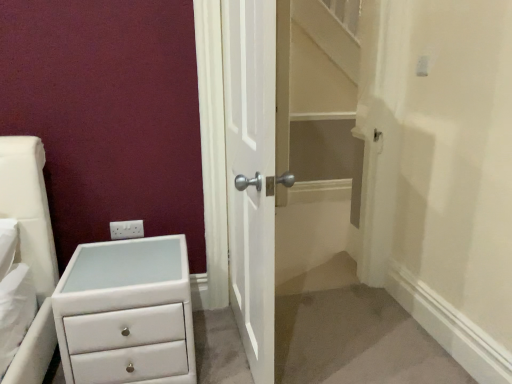
Question: Is white glossy chest of drawers at lower left positioned far away from white wooden door at center?

Choices:
 (A) no
 (B) yes

Answer: (A)

Question: Is white wooden door at center located within white glossy chest of drawers at lower left?

Choices:
 (A) no
 (B) yes

Answer: (A)

Question: Considering the relative sizes of white glossy chest of drawers at lower left and white wooden door at center in the image provided, is white glossy chest of drawers at lower left bigger than white wooden door at center?

Choices:
 (A) yes
 (B) no

Answer: (B)

Question: From a real-world perspective, is white glossy chest of drawers at lower left on top of white wooden door at center?

Choices:
 (A) no
 (B) yes

Answer: (A)

Question: Can you confirm if white glossy chest of drawers at lower left is thinner than white wooden door at center?

Choices:
 (A) yes
 (B) no

Answer: (B)

Question: In the image, is white plastic electric outlet at upper left positioned in front of or behind white glossy chest of drawers at lower left?

Choices:
 (A) behind
 (B) front

Answer: (A)

Question: Is white plastic electric outlet at upper left situated inside white glossy chest of drawers at lower left or outside?

Choices:
 (A) inside
 (B) outside

Answer: (B)

Question: From the image's perspective, is white plastic electric outlet at upper left positioned above or below white glossy chest of drawers at lower left?

Choices:
 (A) above
 (B) below

Answer: (A)

Question: Is point (129, 236) closer or farther from the camera than point (88, 322)?

Choices:
 (A) farther
 (B) closer

Answer: (A)

Question: Is white glossy chest of drawers at lower left in front of or behind white wooden door at center in the image?

Choices:
 (A) front
 (B) behind

Answer: (B)

Question: Is point (82, 336) closer or farther from the camera than point (267, 165)?

Choices:
 (A) farther
 (B) closer

Answer: (A)

Question: Which is correct: white glossy chest of drawers at lower left is inside white wooden door at center, or outside of it?

Choices:
 (A) outside
 (B) inside

Answer: (A)

Question: Is white glossy chest of drawers at lower left taller or shorter than white wooden door at center?

Choices:
 (A) tall
 (B) short

Answer: (B)

Question: Do you think white wooden door at center is within white glossy chest of drawers at lower left, or outside of it?

Choices:
 (A) outside
 (B) inside

Answer: (A)

Question: Considering the relative positions of white wooden door at center and white glossy chest of drawers at lower left in the image provided, is white wooden door at center to the left or to the right of white glossy chest of drawers at lower left?

Choices:
 (A) left
 (B) right

Answer: (B)